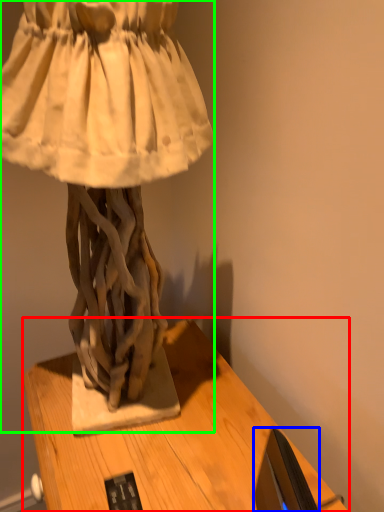
Question: Estimate the real-world distances between objects in this image. Which object is closer to table (highlighted by a red box), computer monitor (highlighted by a blue box) or sculpture (highlighted by a green box)?

Choices:
 (A) computer monitor
 (B) sculpture

Answer: (A)